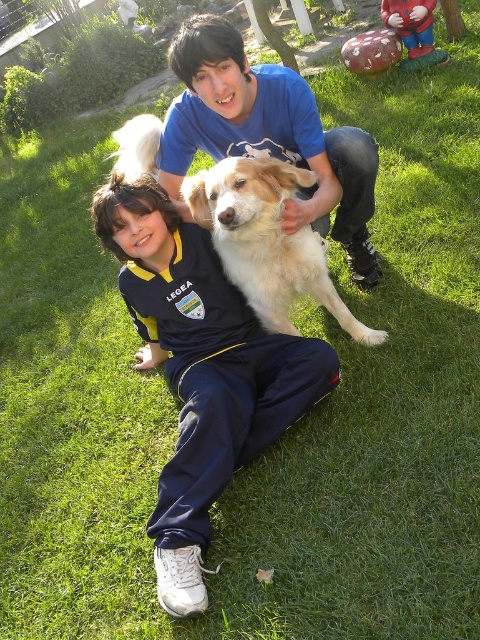
You are organizing a charity clothing drive and need to determine which items can fit into a donation box that has a capacity of 20 liters. Given the dark blue track suit at center and the smooth blue shirt at center, which item is more likely to fit into the box based on their sizes?

The smooth blue shirt at center is more likely to fit into the donation box since it is smaller in size compared to the dark blue track suit at center, which is larger and may exceed the box capacity.

From the picture: You are a photographer trying to capture a clear photo of the golden fur dog at center. Since the dark blue track suit at center is blocking your view, can you move around to the left side to get a better shot? Explain why or why not based on their positions.

The dark blue track suit at center is closer to the viewer than the golden fur dog at center. Moving to the left side might not help because the dark blue track suit at center is still blocking the view unless there is space to move around it.

You are a photographer trying to capture a group photo of the smooth blue shirt at center and the golden fur dog at center. If you want to ensure both subjects are in focus, which one should you adjust the camera focus on first?

The smooth blue shirt at center is larger in size than the golden fur dog at center, so you should focus on the golden fur dog at center first to ensure it is in focus before adjusting for the larger subject.